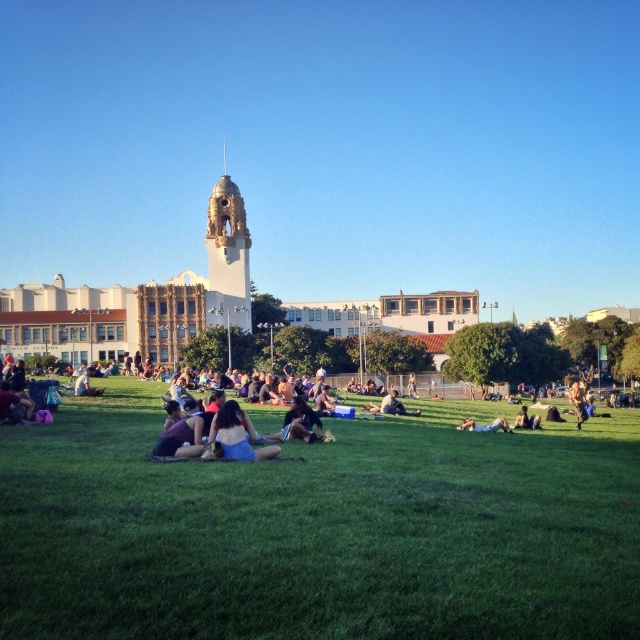
You are a photographer trying to capture both the matte black jacket at lower left and the matte black jacket at center in a single shot. However, you notice that one of them is blocking the view of the other. Which jacket is in front and might be obscuring the other?

The matte black jacket at lower left is in front of the matte black jacket at center, so it might be obscuring the other.

Based on the photo, you are a photographer trying to capture a photo of both the blue denim shorts at center and the blue denim jeans at lower right. Which object should you focus on first if you want to ensure both are in the frame without moving the camera?

You should focus on the blue denim shorts at center first because it is much taller than the blue denim jeans at lower right, so it will be easier to frame both by centering on the taller object.

You are a photographer aiming to capture a person standing on the green grassy field at center while ensuring the dark blue jeans at center are visible. Considering their heights, will the jeans be visible in the photo?

The green grassy field at center is much taller than the dark blue jeans at center, so the jeans might be partially or fully obscured by the grass in the photo.